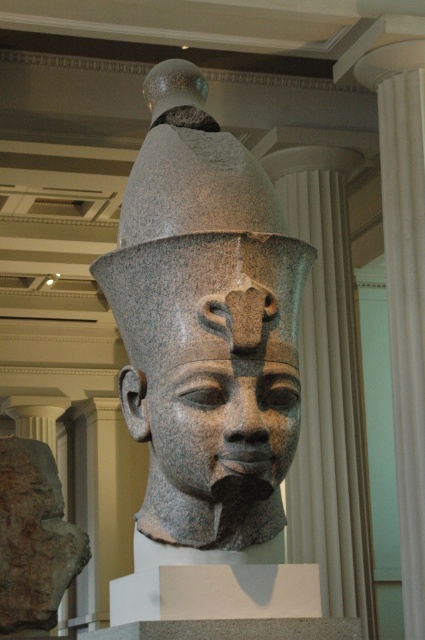
You are a museum curator examining the granite statue at center and the granite statue head at center. Which object is positioned higher in the image?

The granite statue at center is positioned higher than the granite statue head at center.

You are standing in a museum and see the ancient Egyptian stone head sculpture. A point labeled as point [405,582] is marked on the sculpture. The museum has a rule that visitors must stay at least 20 meters away from any exhibit. Can you safely approach the sculpture without violating the rule?

The distance between you and the point labeled point [405,582] on the sculpture is 21.68 meters, which exceeds the 20 meters requirement. Therefore, you can safely approach the sculpture without violating the museum rule.